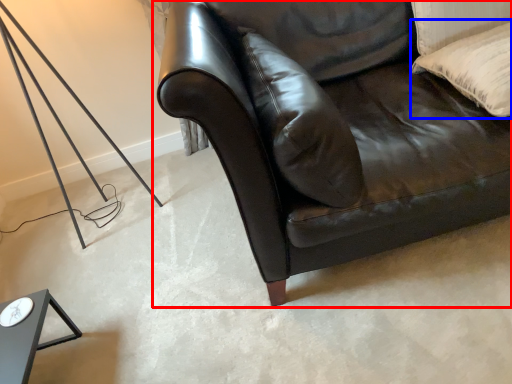
Question: Among these objects, which one is farthest to the camera, studio couch (highlighted by a red box) or pillow (highlighted by a blue box)?

Choices:
 (A) studio couch
 (B) pillow

Answer: (B)